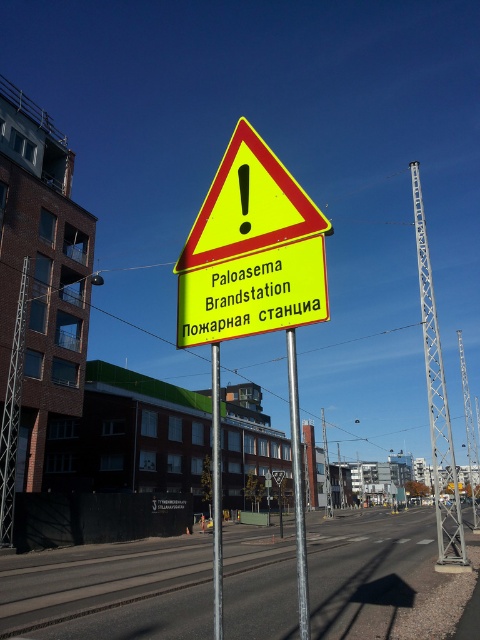
Measure the distance between silver metallic pole at right and silver metallic pole at center.

silver metallic pole at right is 84.92 meters away from silver metallic pole at center.

Which is above, silver metallic pole at right or silver metallic pole at center?

silver metallic pole at center

Who is more distant from viewer, (452, 452) or (310, 636)?

The point (452, 452) is more distant.

The image size is (480, 640). Identify the location of silver metallic pole at right. (437, 406).

Can you confirm if silver metallic pole at center is taller than yellow plastic signpost at center?

Yes, silver metallic pole at center is taller than yellow plastic signpost at center.

Based on the photo, between silver metallic pole at center and yellow plastic signpost at center, which one appears on the right side from the viewer's perspective?

silver metallic pole at center

Is point (294, 339) positioned behind point (216, 394)?

That is False.

The width and height of the screenshot is (480, 640). I want to click on silver metallic pole at center, so click(x=298, y=486).

Is the position of yellow plastic sign at center more distant than that of silver metallic pole at center?

Yes, yellow plastic sign at center is further from the viewer.

Can you confirm if yellow plastic sign at center is taller than silver metallic pole at center?

No.

Identify the location of yellow plastic sign at center. (253, 292).